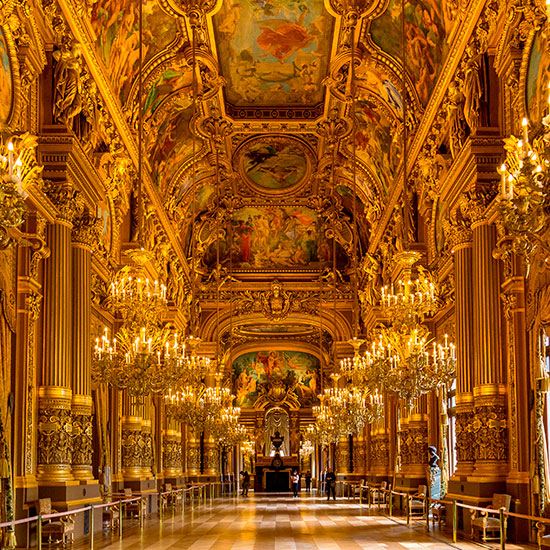
Find the location of `ceiling`. ceiling is located at coordinates (262, 101).